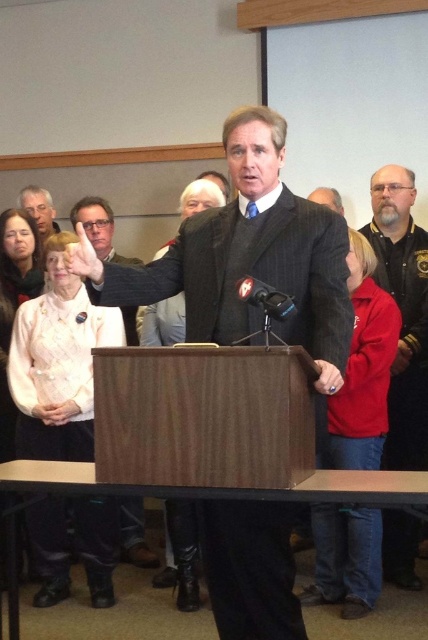
Based on the photo, you are a photographer positioned at the front of the audience. You want to take a closeup photo of the dark brown leather jacket at right without moving your position. Can you do it with a standard zoom lens that has a maximum zoom of 200mm?

The dark brown leather jacket at right is 3.24 meters away from the camera. With a standard zoom lens of 200mm, it is possible to capture a closeup photo without moving your position, as the distance is within the effective range of the lens.

You are organizing a formal event and need to choose between the dark gray pinstripe suit at center and the matte black suit at center for the speaker. Based on their sizes, which suit would be more appropriate if you prefer a more imposing look?

The dark gray pinstripe suit at center is larger in size than the matte black suit at center, making it more appropriate for an imposing look.